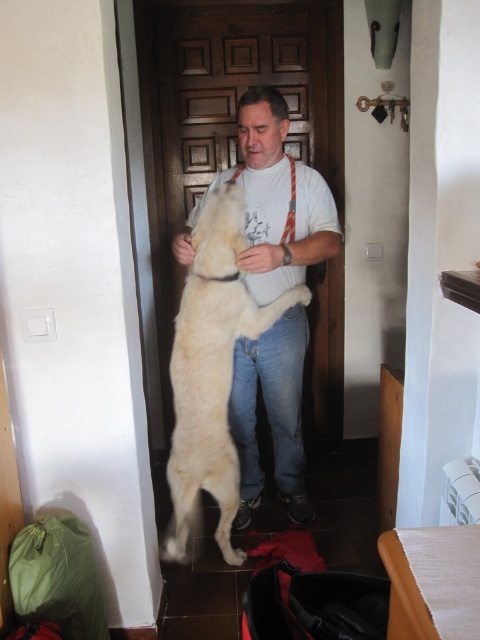
Is light beige fur at center behind beige fabric lift at lower right?

Yes, light beige fur at center is behind beige fabric lift at lower right.

Locate an element on the screen. Image resolution: width=480 pixels, height=640 pixels. light beige fur at center is located at coordinates point(211,376).